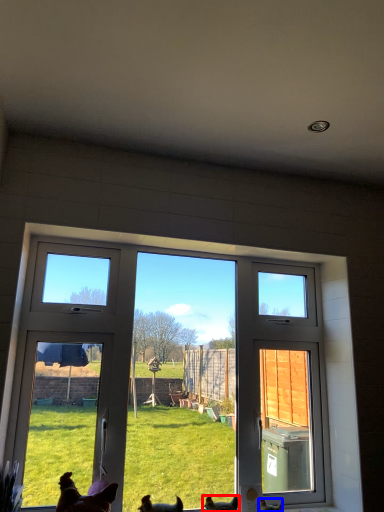
Question: Among these objects, which one is farthest to the camera, chicken (highlighted by a red box) or chicken (highlighted by a blue box)?

Choices:
 (A) chicken
 (B) chicken

Answer: (B)